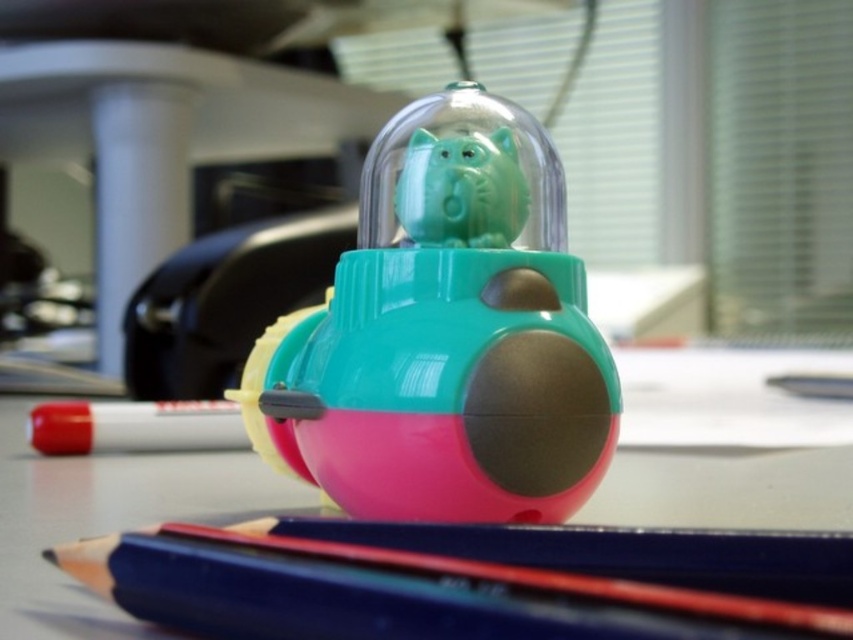
Question: Is pink rubber eraser at center further to the viewer compared to matte green plastic piggy bank at center?

Choices:
 (A) no
 (B) yes

Answer: (A)

Question: Which point appears farthest from the camera in this image?

Choices:
 (A) (73, 531)
 (B) (296, 337)
 (C) (222, 416)

Answer: (C)

Question: Can you confirm if matte plastic toy at center is wider than smooth blue pencil at center?

Choices:
 (A) yes
 (B) no

Answer: (B)

Question: Which of the following is the closest to the observer?

Choices:
 (A) pink rubber eraser at center
 (B) matte plastic toy at center
 (C) red matte marker at lower left
 (D) matte green plastic piggy bank at center

Answer: (A)

Question: Is matte plastic toy at center above smooth blue pencil at center?

Choices:
 (A) no
 (B) yes

Answer: (B)

Question: Which point is closer to the camera taking this photo?

Choices:
 (A) (201, 557)
 (B) (373, 337)

Answer: (A)